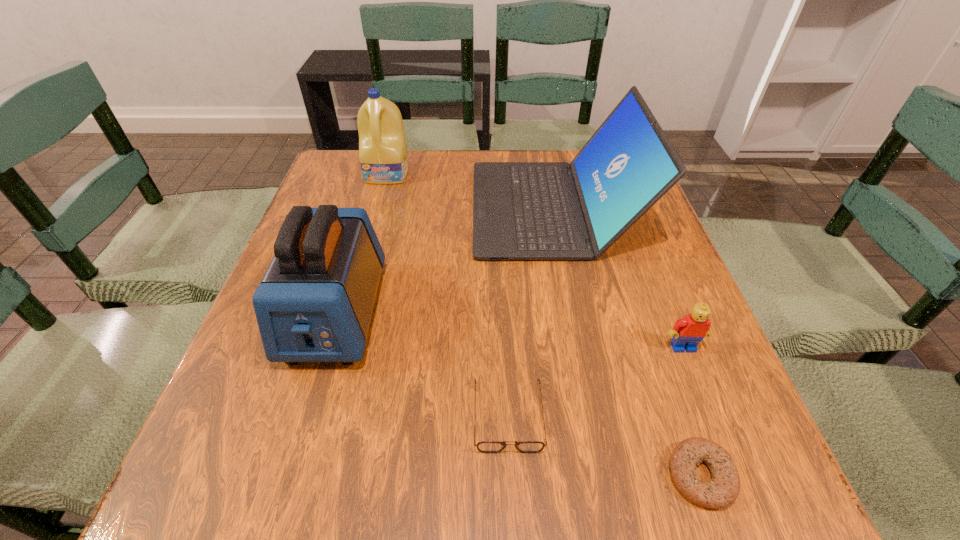
Find the location of a particular element. The image size is (960, 540). blank area located 0.050m on the front-facing side of the toaster is located at coordinates (310, 399).

This screenshot has height=540, width=960. In order to click on vacant space located on the face of the Lego in this screenshot , I will do `click(714, 427)`.

This screenshot has height=540, width=960. In order to click on vacant space situated 0.050m on the front-facing side of the second shortest object in this screenshot , I will do `click(512, 488)`.

The height and width of the screenshot is (540, 960). What are the coordinates of `free location located on the back of the shortest object` in the screenshot? It's located at (633, 277).

Image resolution: width=960 pixels, height=540 pixels. I want to click on laptop computer at the far edge, so click(521, 210).

Locate an element on the screen. The width and height of the screenshot is (960, 540). detergent at the far edge is located at coordinates (383, 157).

This screenshot has height=540, width=960. Identify the location of sunglasses present at the near edge. (485, 446).

Where is `bagel that is at the near edge`? bagel that is at the near edge is located at coordinates (721, 491).

Where is `detergent present at the left edge`? detergent present at the left edge is located at coordinates (383, 157).

Where is `toaster at the left edge`? The height and width of the screenshot is (540, 960). toaster at the left edge is located at coordinates (314, 304).